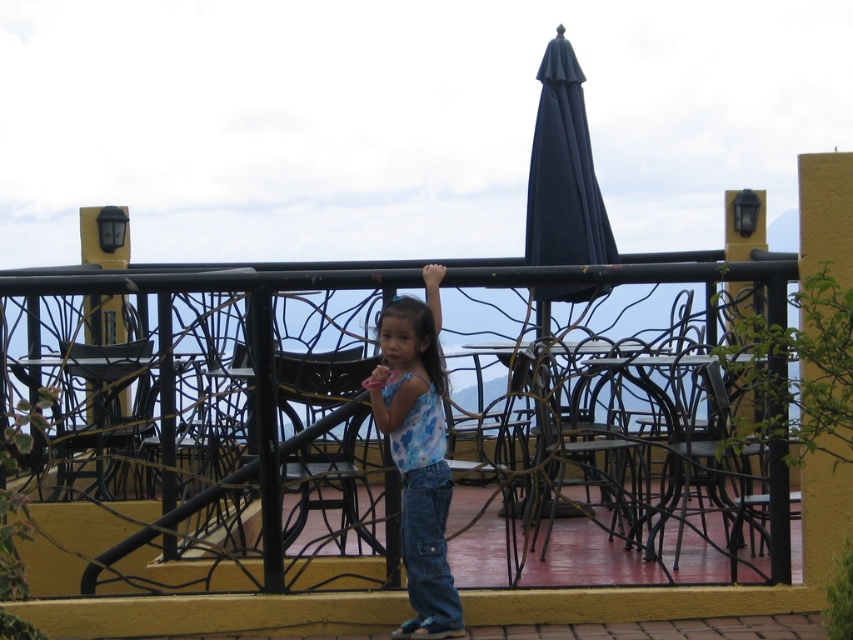
Question: Which object appears closest to the camera in this image?

Choices:
 (A) black wrought iron fence at center
 (B) blue tie-dye tank top at center

Answer: (A)

Question: Can you confirm if blue tie-dye tank top at center is positioned above matte skin hand at center?

Choices:
 (A) no
 (B) yes

Answer: (A)

Question: Is black wrought iron fence at center behind blue tie-dye tank top at center?

Choices:
 (A) yes
 (B) no

Answer: (B)

Question: Is blue tie-dye tank top at center above light skin hand at upper center?

Choices:
 (A) yes
 (B) no

Answer: (B)

Question: Among these objects, which one is farthest from the camera?

Choices:
 (A) blue tie-dye tank top at center
 (B) black wrought iron fence at center
 (C) matte skin hand at center
 (D) light skin hand at upper center

Answer: (D)

Question: Which of the following is the farthest from the observer?

Choices:
 (A) black wrought iron fence at center
 (B) blue tie-dye tank top at center
 (C) light skin hand at upper center
 (D) matte skin hand at center

Answer: (C)